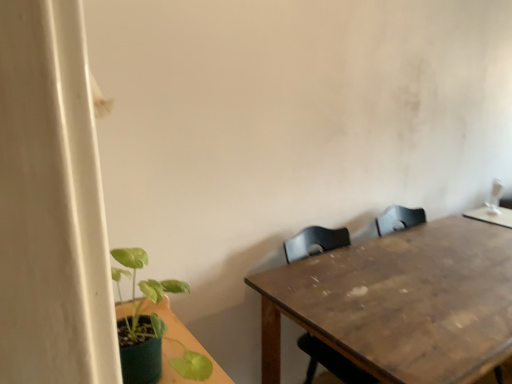
Question: Does point (452, 344) appear closer or farther from the camera than point (152, 382)?

Choices:
 (A) closer
 (B) farther

Answer: (B)

Question: Is wooden table at center situated inside green matte plant at lower left or outside?

Choices:
 (A) inside
 (B) outside

Answer: (B)

Question: Based on their sizes in the image, would you say wooden table at center is bigger or smaller than green matte plant at lower left?

Choices:
 (A) small
 (B) big

Answer: (B)

Question: Is green matte plant at lower left taller or shorter than wooden table at center?

Choices:
 (A) tall
 (B) short

Answer: (B)

Question: Is green matte plant at lower left in front of or behind wooden table at center in the image?

Choices:
 (A) front
 (B) behind

Answer: (A)

Question: Does point (205, 362) appear closer or farther from the camera than point (377, 296)?

Choices:
 (A) closer
 (B) farther

Answer: (A)

Question: In terms of size, does green matte plant at lower left appear bigger or smaller than wooden table at center?

Choices:
 (A) small
 (B) big

Answer: (A)